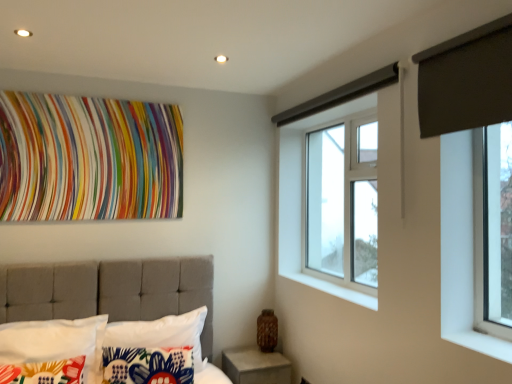
I want to click on blank space situated above multicolored fabric at upper center (from a real-world perspective), so click(90, 90).